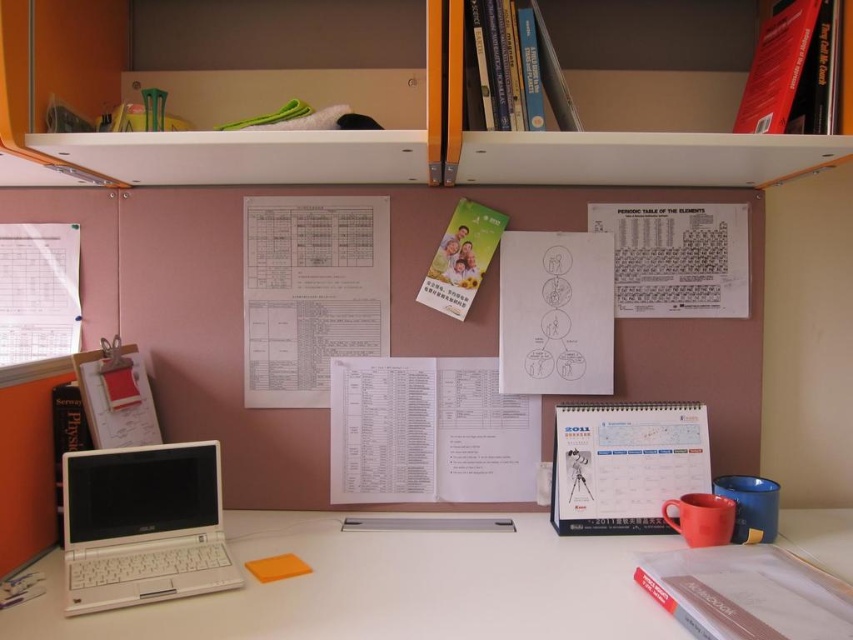
Question: Which of the following is the closest to the observer?

Choices:
 (A) white plastic shelf at upper center
 (B) white plastic laptop at lower left
 (C) white plastic bookshelf at upper center

Answer: (C)

Question: Is white plastic laptop at lower left above white plastic shelf at upper center?

Choices:
 (A) no
 (B) yes

Answer: (A)

Question: Does white plastic bookshelf at upper center have a smaller size compared to white plastic shelf at upper center?

Choices:
 (A) yes
 (B) no

Answer: (B)

Question: Considering the relative positions of white plastic laptop at lower left and white plastic shelf at upper center in the image provided, where is white plastic laptop at lower left located with respect to white plastic shelf at upper center?

Choices:
 (A) right
 (B) left

Answer: (B)

Question: Which point is closer to the camera?

Choices:
 (A) white plastic shelf at upper center
 (B) white plastic bookshelf at upper center
 (C) white plastic computer desk at lower center
 (D) white plastic laptop at lower left

Answer: (C)

Question: Which object is the closest to the white plastic computer desk at lower center?

Choices:
 (A) white plastic laptop at lower left
 (B) white plastic bookshelf at upper center
 (C) white plastic shelf at upper center

Answer: (A)